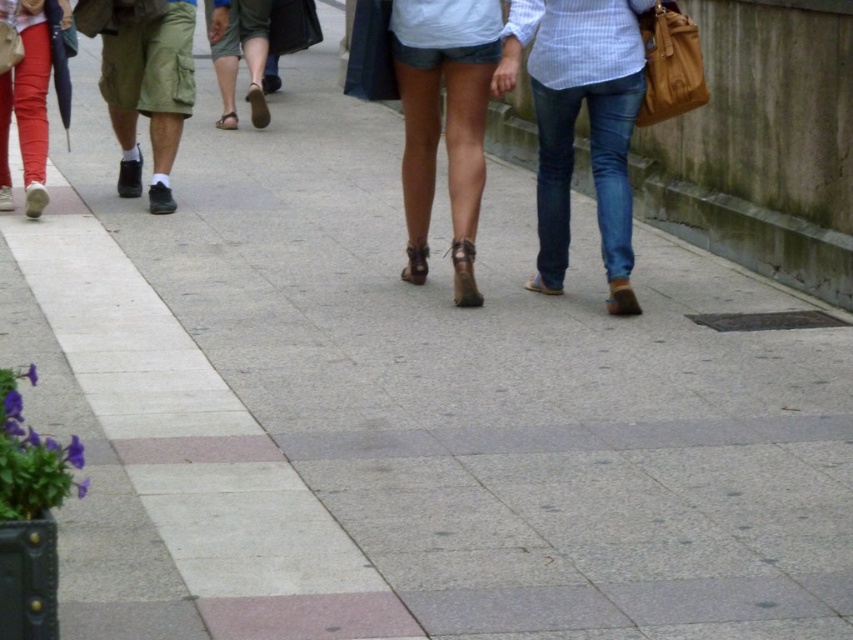
Does blue jeans at center have a lesser height compared to green cargo shorts at left?

Incorrect, blue jeans at center's height does not fall short of green cargo shorts at left's.

Which is more to the left, blue jeans at center or green cargo shorts at left?

From the viewer's perspective, green cargo shorts at left appears more on the left side.

The height and width of the screenshot is (640, 853). Describe the element at coordinates (573, 122) in the screenshot. I see `blue jeans at center` at that location.

This screenshot has width=853, height=640. What are the coordinates of `blue jeans at center` in the screenshot? It's located at [x=573, y=122].

Which of these two, green cargo shorts at left or matte red pants at left, stands taller?

green cargo shorts at left

Is the position of green cargo shorts at left more distant than that of matte red pants at left?

Yes.

Does point (136, 179) come behind point (44, 193)?

Yes, point (136, 179) is farther from viewer.

Where is `green cargo shorts at left`? The image size is (853, 640). green cargo shorts at left is located at coordinates (144, 83).

Between point (473, 17) and point (59, 102), which one is positioned behind?

Positioned behind is point (59, 102).

Which is more to the left, denim shorts at center or matte red pants at left?

From the viewer's perspective, matte red pants at left appears more on the left side.

Does point (456, 29) lie in front of point (70, 90)?

Yes, point (456, 29) is closer to viewer.

Locate an element on the screen. denim shorts at center is located at coordinates pyautogui.click(x=445, y=122).